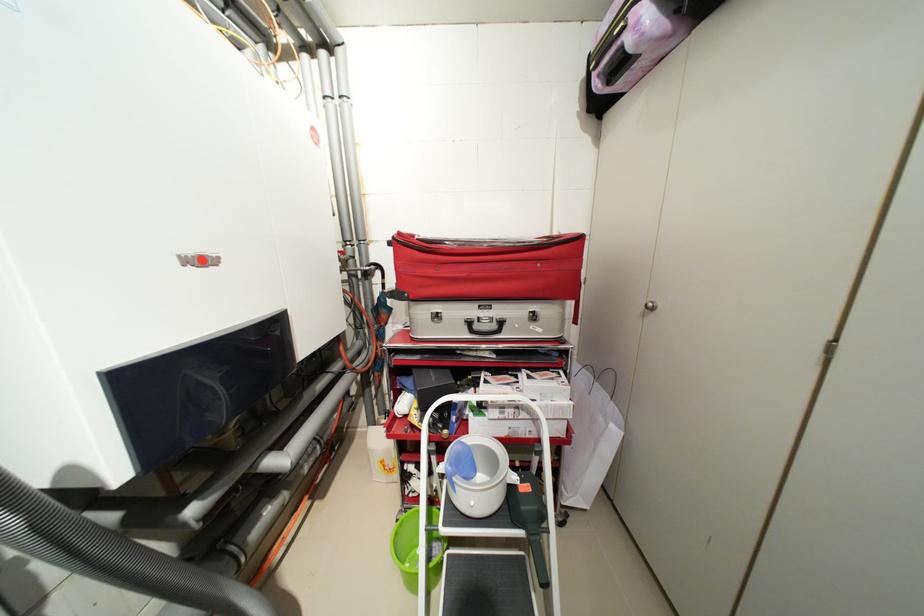
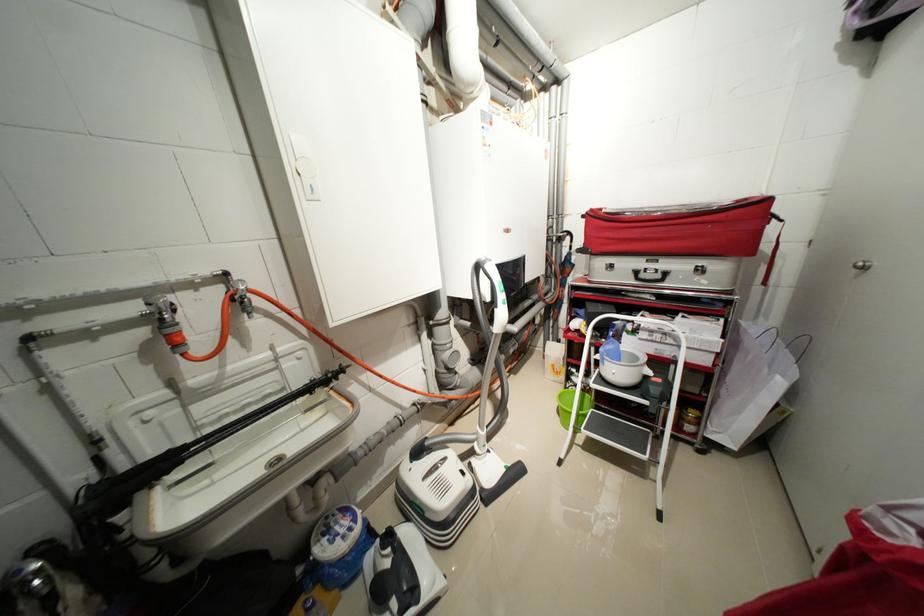
Where in the second image is the point corresponding to (x=623, y=434) from the first image?

(787, 384)